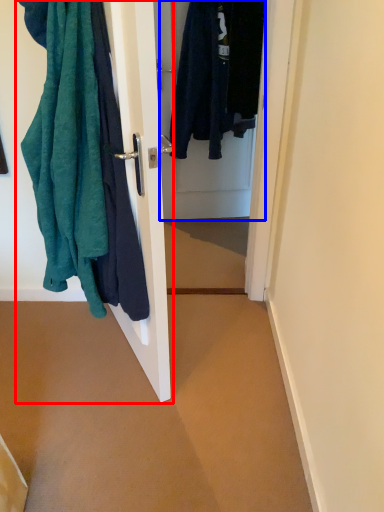
Question: Which of the following is the closest to the observer, closet (highlighted by a red box) or door (highlighted by a blue box)?

Choices:
 (A) closet
 (B) door

Answer: (A)